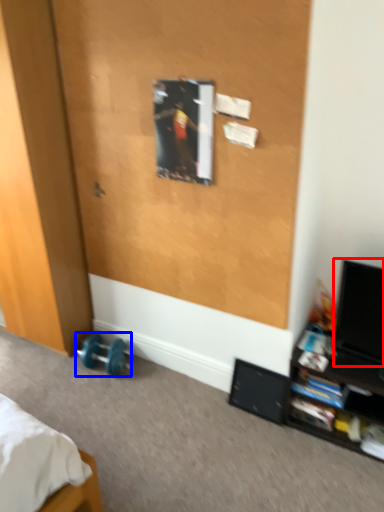
Question: Which of the following is the closest to the observer, computer monitor (highlighted by a red box) or dumbbell (highlighted by a blue box)?

Choices:
 (A) computer monitor
 (B) dumbbell

Answer: (A)